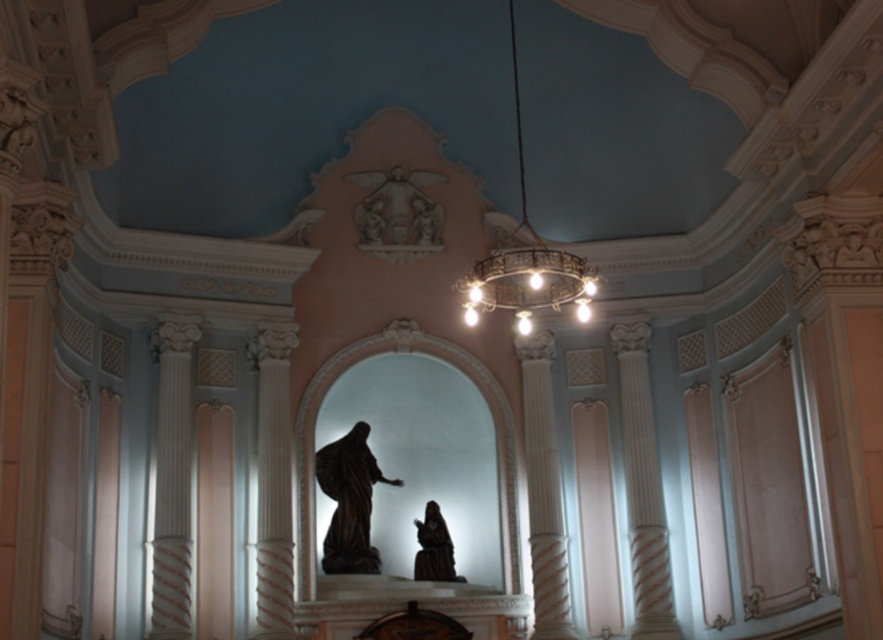
Question: Which object is closer to the camera taking this photo?

Choices:
 (A) dark brown polished wood statue at center
 (B) white stone sculpture at upper center
 (C) dark brown wood statue at center
 (D) gold metallic chandelier at center

Answer: (D)

Question: Which point is farther from the camera taking this photo?

Choices:
 (A) (363, 218)
 (B) (442, 520)
 (C) (473, 317)
 (D) (356, 490)

Answer: (A)

Question: Is gold metallic chandelier at center behind dark brown wood statue at center?

Choices:
 (A) yes
 (B) no

Answer: (B)

Question: Is white stone sculpture at upper center wider than dark brown wood statue at center?

Choices:
 (A) no
 (B) yes

Answer: (B)

Question: Does gold metallic chandelier at center have a lesser width compared to white stone sculpture at upper center?

Choices:
 (A) yes
 (B) no

Answer: (B)

Question: Which object appears farthest from the camera in this image?

Choices:
 (A) white stone sculpture at upper center
 (B) gold metallic chandelier at center

Answer: (A)